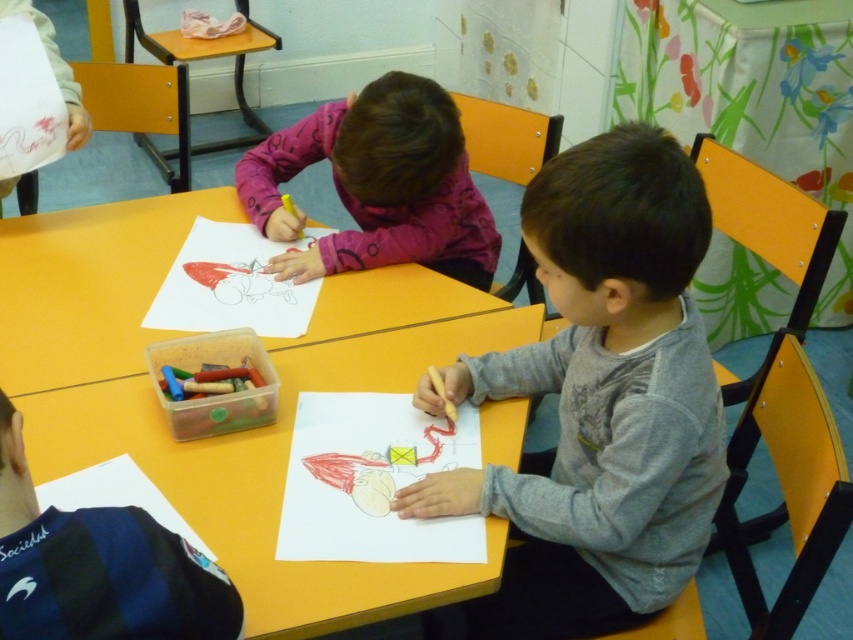
Who is positioned more to the left, gray cotton shirt at center or smooth paper at center?

smooth paper at center is more to the left.

What do you see at coordinates (598, 403) in the screenshot? I see `gray cotton shirt at center` at bounding box center [598, 403].

I want to click on gray cotton shirt at center, so click(598, 403).

Who is more forward, (364, 611) or (25, 376)?

Point (364, 611)

You are a GUI agent. You are given a task and a screenshot of the screen. Output one action in this format:
    pyautogui.click(x=<x>, y=<y>)
    Task: Click on the yellow plastic table at center
    This screenshot has height=640, width=853.
    Given the screenshot: What is the action you would take?
    pyautogui.click(x=276, y=472)

Does yellow plastic table at center have a greater height compared to smooth paper at center?

Yes, yellow plastic table at center is taller than smooth paper at center.

Is yellow plastic table at center shorter than smooth paper at center?

No.

Locate an element on the screen. The image size is (853, 640). yellow plastic table at center is located at coordinates (276, 472).

At what (x,y) coordinates should I click in order to perform the action: click on yellow plastic table at center. Please return your answer as a coordinate pair (x, y). Looking at the image, I should click on (276, 472).